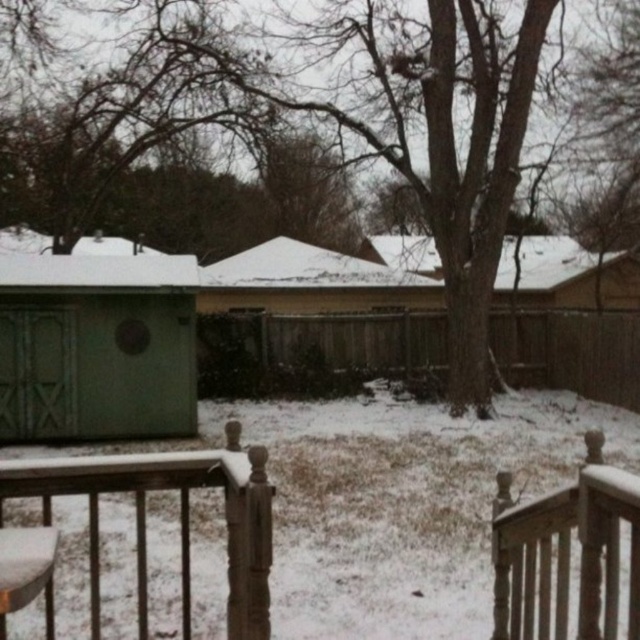
Question: Does green matte shed at left have a larger size compared to white wood railing at lower right?

Choices:
 (A) no
 (B) yes

Answer: (A)

Question: Is white wood railing at lower right positioned at the back of brown wood cabin at upper center?

Choices:
 (A) yes
 (B) no

Answer: (B)

Question: Is wooden railing at lower center positioned at the back of brown wooden fence at center?

Choices:
 (A) yes
 (B) no

Answer: (B)

Question: Which point is farther to the camera?

Choices:
 (A) green matte shed at left
 (B) brown wooden fence at center
 (C) wooden railing at lower center

Answer: (B)

Question: Which of the following is the farthest from the observer?

Choices:
 (A) (540, 237)
 (B) (186, 372)

Answer: (A)

Question: Which point is closer to the camera?

Choices:
 (A) (56, 595)
 (B) (550, 506)

Answer: (B)